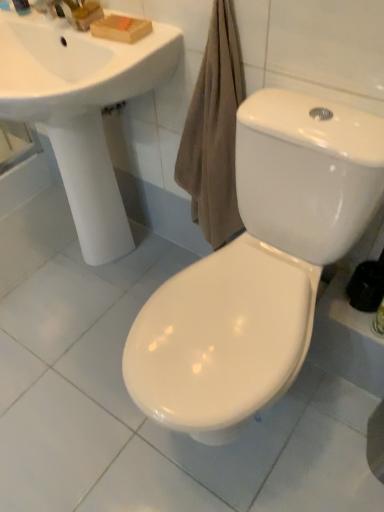
Question: From a real-world perspective, is white glossy toilet at center over matte plastic soap at upper left?

Choices:
 (A) no
 (B) yes

Answer: (A)

Question: Can you confirm if white glossy toilet at center is positioned to the right of matte plastic soap at upper left?

Choices:
 (A) no
 (B) yes

Answer: (B)

Question: Is white glossy toilet at center in contact with matte plastic soap at upper left?

Choices:
 (A) yes
 (B) no

Answer: (B)

Question: Does white glossy toilet at center lie behind matte plastic soap at upper left?

Choices:
 (A) no
 (B) yes

Answer: (A)

Question: Is white glossy toilet at center facing towards matte plastic soap at upper left?

Choices:
 (A) no
 (B) yes

Answer: (A)

Question: Is white glossy toilet at center wider than matte plastic soap at upper left?

Choices:
 (A) no
 (B) yes

Answer: (B)

Question: Can you confirm if white glossy toilet at center is positioned to the left of white glossy sink at upper left?

Choices:
 (A) no
 (B) yes

Answer: (A)

Question: Does white glossy toilet at center have a lesser height compared to white glossy sink at upper left?

Choices:
 (A) no
 (B) yes

Answer: (A)

Question: Would you say white glossy toilet at center is outside white glossy sink at upper left?

Choices:
 (A) yes
 (B) no

Answer: (A)

Question: Is white glossy toilet at center further to camera compared to white glossy sink at upper left?

Choices:
 (A) yes
 (B) no

Answer: (B)

Question: Does white glossy toilet at center have a greater width compared to white glossy sink at upper left?

Choices:
 (A) no
 (B) yes

Answer: (B)

Question: From a real-world perspective, is white glossy toilet at center positioned under white glossy sink at upper left based on gravity?

Choices:
 (A) no
 (B) yes

Answer: (B)

Question: Does white glossy sink at upper left touch white glossy toilet at center?

Choices:
 (A) yes
 (B) no

Answer: (B)